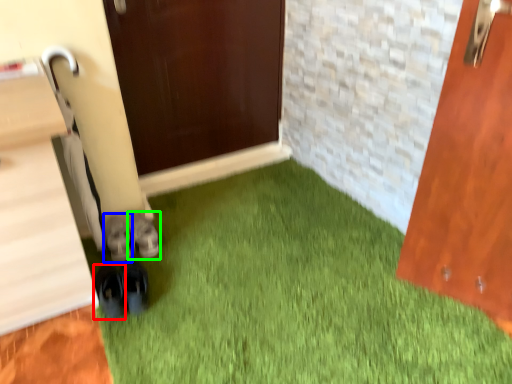
Question: Which object is positioned closest to footwear (highlighted by a red box)? Select from footwear (highlighted by a blue box) and footwear (highlighted by a green box).

Choices:
 (A) footwear
 (B) footwear

Answer: (A)